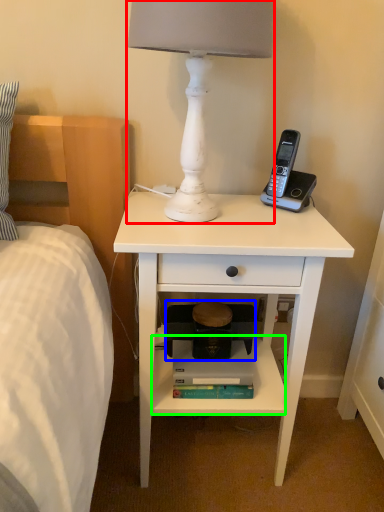
Question: Which is farther away from lamp (highlighted by a red box)? step stool (highlighted by a blue box) or shelf (highlighted by a green box)?

Choices:
 (A) step stool
 (B) shelf

Answer: (B)